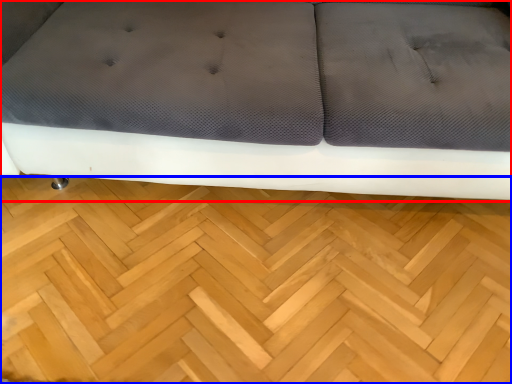
Question: Which of the following is the farthest to the observer, studio couch (highlighted by a red box) or hardwood (highlighted by a blue box)?

Choices:
 (A) studio couch
 (B) hardwood

Answer: (B)